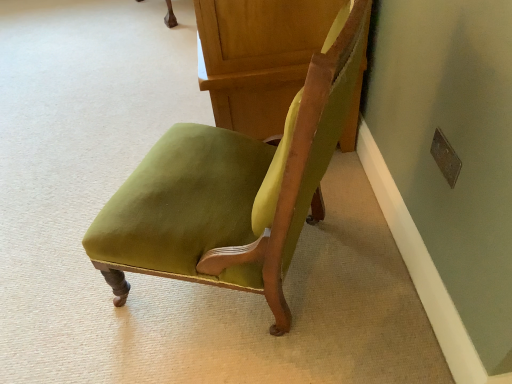
Question: Visually, is velvet green chair at center positioned to the left or to the right of velvet green chair at center?

Choices:
 (A) right
 (B) left

Answer: (B)

Question: Is velvet green chair at center taller or shorter than velvet green chair at center?

Choices:
 (A) short
 (B) tall

Answer: (B)

Question: Based on their sizes in the image, would you say velvet green chair at center is bigger or smaller than velvet green chair at center?

Choices:
 (A) big
 (B) small

Answer: (B)

Question: Is point (329, 13) positioned closer to the camera than point (204, 225)?

Choices:
 (A) closer
 (B) farther

Answer: (B)

Question: Is velvet green chair at center situated inside velvet green chair at center or outside?

Choices:
 (A) inside
 (B) outside

Answer: (B)

Question: Considering the positions of velvet green chair at center and velvet green chair at center in the image, is velvet green chair at center taller or shorter than velvet green chair at center?

Choices:
 (A) tall
 (B) short

Answer: (B)

Question: In the image, is velvet green chair at center positioned in front of or behind velvet green chair at center?

Choices:
 (A) front
 (B) behind

Answer: (B)